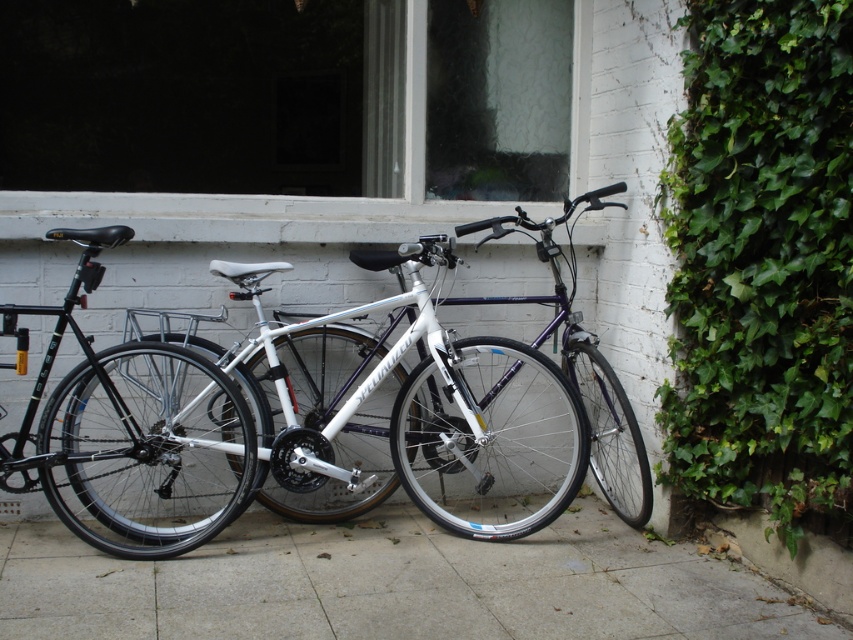
You are a delivery person trying to park your bike on the gray concrete pavement at center. However, there is a white matte bicycle at center already parked there. Can you park your bike next to it without moving the existing bicycle?

The gray concrete pavement at center is positioned under the white matte bicycle at center, meaning the existing bicycle is already occupying the space on the pavement. Therefore, you cannot park your bike next to it without moving the existing bicycle.

You are standing on the gray concrete pavement at center and want to reach the white matte bicycle at center. Which direction should you move in to get closer to the bicycle?

Since the gray concrete pavement at center is in front of the white matte bicycle at center, you should move backward to get closer to the bicycle.

You are trying to determine the spatial relationship between the green leafy ivy at right and the shiny silver bicycle at left in the scene. Which object occupies more horizontal space in the image?

The shiny silver bicycle at left occupies more horizontal space than the green leafy ivy at right because the ivy has a lesser width compared to the bicycle.